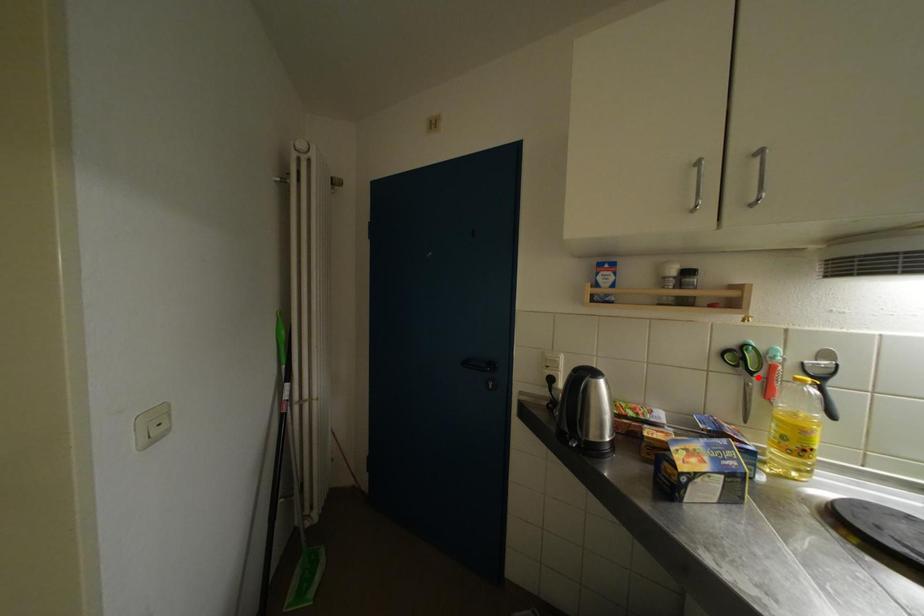
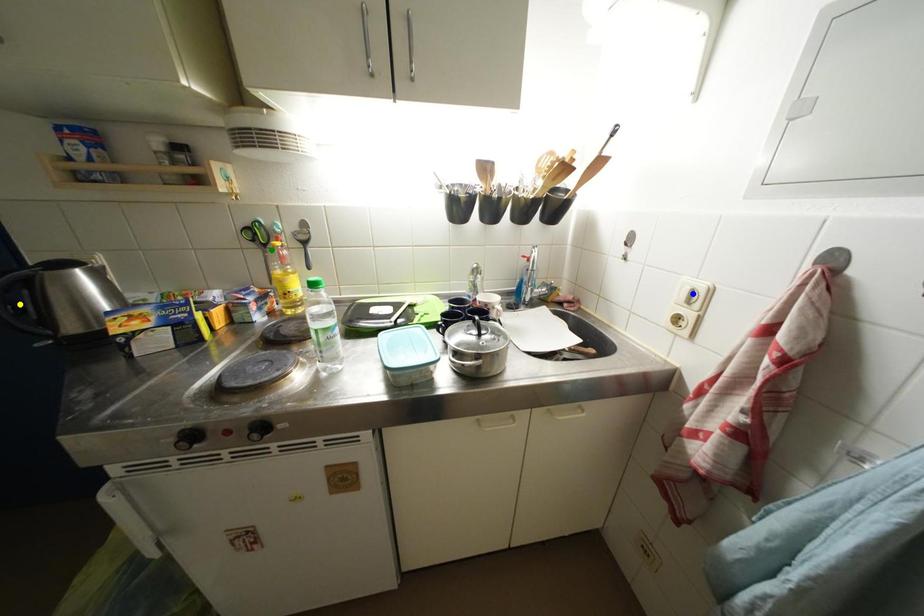
Question: I am providing you with two images of the same scene from different viewpoints. A red point is marked on the first image. You are given multiple points on the second image. In image 2, which mark is for the same physical point as the one in image 1?

Choices:
 (A) green point
 (B) yellow point
 (C) blue point

Answer: (A)